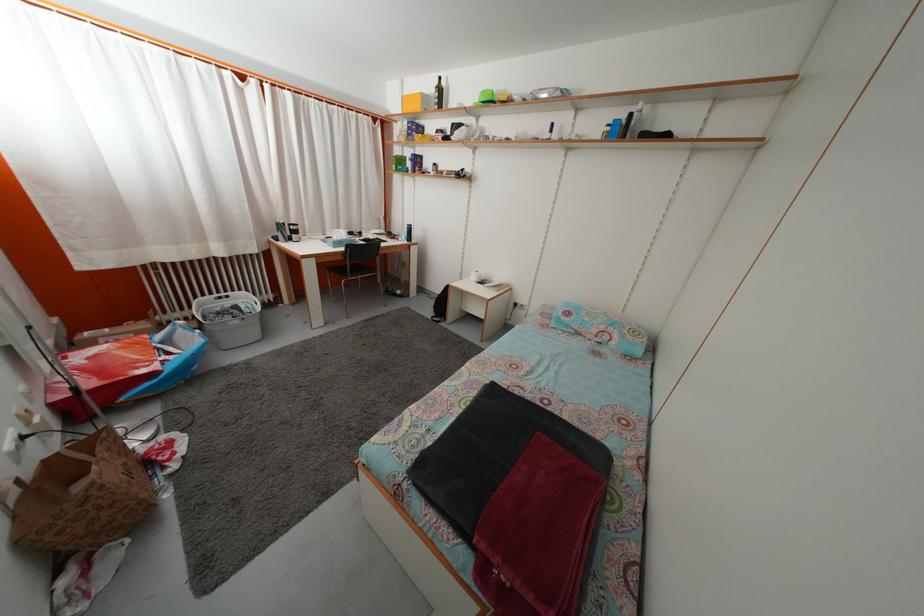
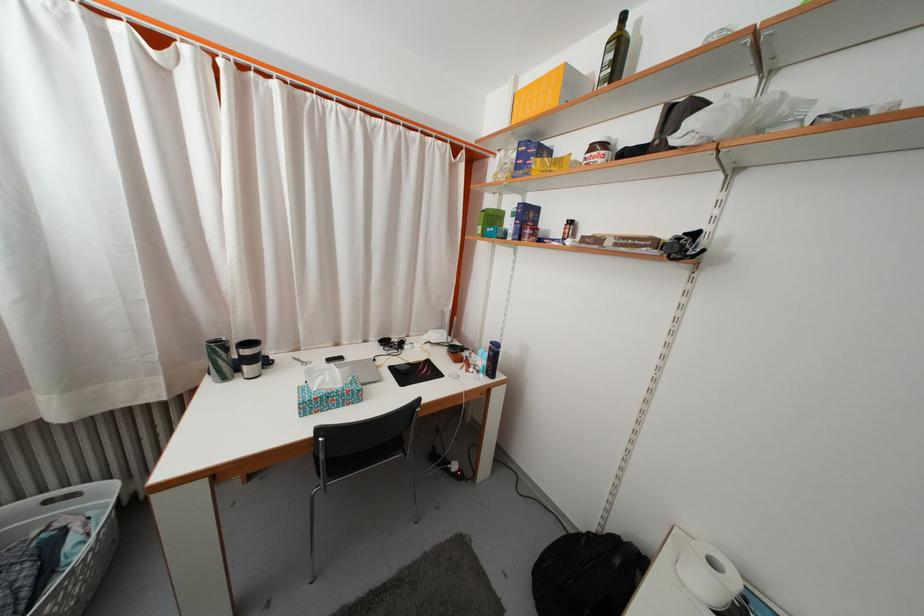
In the second image, find the point that corresponds to the point at 415,142 in the first image.

(523, 175)